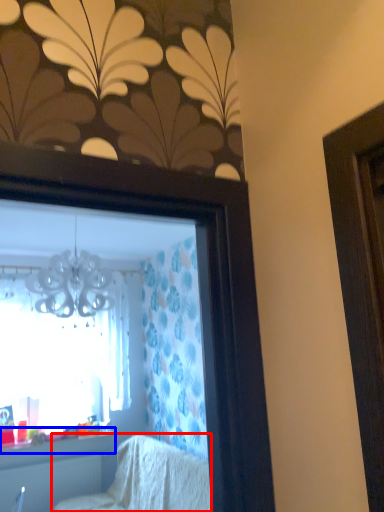
Question: Which point is further to the camera, furniture (highlighted by a red box) or window sill (highlighted by a blue box)?

Choices:
 (A) furniture
 (B) window sill

Answer: (B)